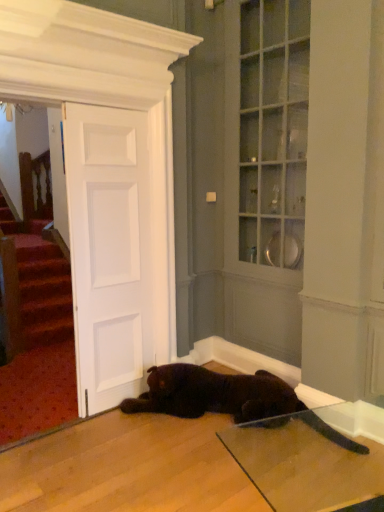
Image resolution: width=384 pixels, height=512 pixels. Find the location of `free spot to the left of shiny black cat at lower center`. free spot to the left of shiny black cat at lower center is located at coordinates (100, 467).